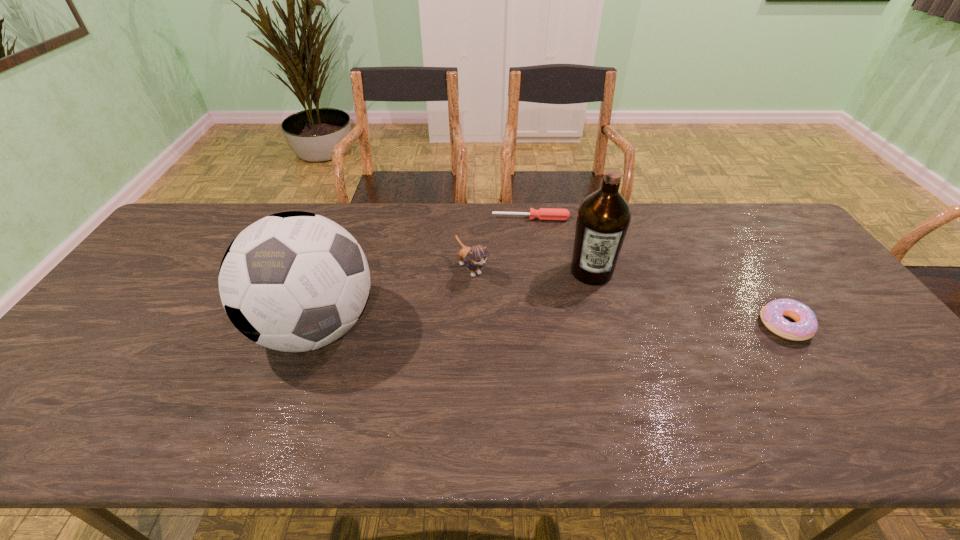
Where is `the leftmost object`? The image size is (960, 540). the leftmost object is located at coordinates (293, 281).

Where is `the rightmost object`? Image resolution: width=960 pixels, height=540 pixels. the rightmost object is located at coordinates (806, 325).

Find the location of a particular element. This screenshot has height=540, width=960. the second shortest object is located at coordinates (806, 325).

Find the location of a particular element. The width and height of the screenshot is (960, 540). screwdriver is located at coordinates (555, 214).

The width and height of the screenshot is (960, 540). In order to click on the farthest object in this screenshot , I will do `click(555, 214)`.

Where is `the third tallest object`? Image resolution: width=960 pixels, height=540 pixels. the third tallest object is located at coordinates tap(474, 257).

At what (x,y) coordinates should I click in order to perform the action: click on kitten. Please return your answer as a coordinate pair (x, y). Looking at the image, I should click on (474, 257).

Image resolution: width=960 pixels, height=540 pixels. I want to click on olive oil, so click(603, 218).

What are the coordinates of `vacant space located on the left of the second shortest object` in the screenshot? It's located at tap(703, 325).

Image resolution: width=960 pixels, height=540 pixels. I want to click on free space located 0.350m at the tip of the farthest object, so click(x=534, y=296).